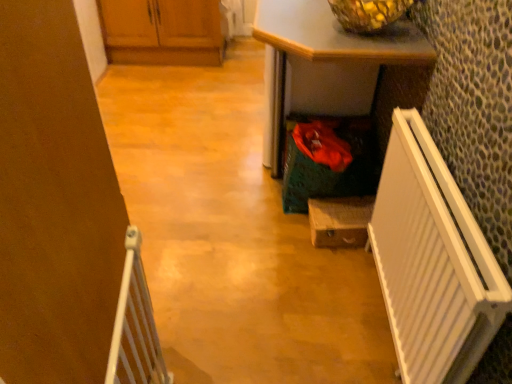
Image resolution: width=512 pixels, height=384 pixels. What are the coordinates of `white plastic radiator at left, positioned as the 1th radiator in left-to-right order` in the screenshot? It's located at [x=135, y=326].

Find the location of a particular element. Image resolution: width=512 pixels, height=384 pixels. wooden cabinets at upper left, marked as the 1th cabinetry in a top-to-bottom arrangement is located at coordinates (163, 32).

This screenshot has height=384, width=512. Find the location of `the 1st cabinetry counting from the left of the white plastic radiator at right, the second radiator viewed from the left`. the 1st cabinetry counting from the left of the white plastic radiator at right, the second radiator viewed from the left is located at coordinates (340, 221).

Can we say white plastic radiator at right, the second radiator viewed from the left, lies outside wooden drawer at center, which is the second cabinetry in back-to-front order?

Indeed, white plastic radiator at right, the second radiator viewed from the left, is completely outside wooden drawer at center, which is the second cabinetry in back-to-front order.

From the image's perspective, is white plastic radiator at right, acting as the first radiator starting from the right, below wooden drawer at center, which appears as the 2th cabinetry when viewed from the top?

Yes, from the image's perspective, white plastic radiator at right, acting as the first radiator starting from the right, is below wooden drawer at center, which appears as the 2th cabinetry when viewed from the top.

Is white plastic radiator at right, the second radiator viewed from the left, not close to wooden drawer at center, marked as the 2th cabinetry in a left-to-right arrangement?

No, there isn't a large distance between white plastic radiator at right, the second radiator viewed from the left, and wooden drawer at center, marked as the 2th cabinetry in a left-to-right arrangement.

The image size is (512, 384). Identify the location of cabinetry that is the 1st one when counting leftward from the white plastic radiator at right, the second radiator viewed from the left. pos(340,221).

Is wooden drawer at center, acting as the 1th cabinetry starting from the front, turned away from white plastic radiator at right, acting as the first radiator starting from the right?

No, wooden drawer at center, acting as the 1th cabinetry starting from the front,'s orientation is not away from white plastic radiator at right, acting as the first radiator starting from the right.

Between point (347, 241) and point (437, 186), which one is positioned in front?

The point (437, 186) is closer to the camera.

Between green textured desk at center and white plastic radiator at left, positioned as the 1th radiator in left-to-right order, which one has larger size?

Bigger between the two is green textured desk at center.

From the image's perspective, is green textured desk at center above or below white plastic radiator at left, positioned as the 1th radiator in left-to-right order?

green textured desk at center is situated higher than white plastic radiator at left, positioned as the 1th radiator in left-to-right order, in the image.

Considering their positions, is green textured desk at center located in front of or behind white plastic radiator at left, positioned as the 1th radiator in left-to-right order?

In the image, green textured desk at center appears behind white plastic radiator at left, positioned as the 1th radiator in left-to-right order.

In the scene shown: Does green textured desk at center turn towards white plastic radiator at left, which is the 2th radiator in right-to-left order?

No, green textured desk at center is not facing towards white plastic radiator at left, which is the 2th radiator in right-to-left order.

The width and height of the screenshot is (512, 384). What are the coordinates of `the 1st radiator in front when counting from the wooden cabinets at upper left, which appears as the 2th cabinetry when ordered from the bottom` in the screenshot? It's located at (432, 262).

In the scene shown: Does wooden cabinets at upper left, which appears as the 2th cabinetry when ordered from the bottom, lie behind white plastic radiator at right, the second radiator viewed from the left?

Yes.

Could white plastic radiator at right, the second radiator viewed from the left, be considered to be inside wooden cabinets at upper left, arranged as the 1th cabinetry when viewed from the left?

No, white plastic radiator at right, the second radiator viewed from the left, is located outside of wooden cabinets at upper left, arranged as the 1th cabinetry when viewed from the left.

From a real-world perspective, between wooden cabinets at upper left, arranged as the 1th cabinetry when viewed from the left, and white plastic radiator at right, the second radiator viewed from the left, who is vertically higher?

From a 3D spatial view, white plastic radiator at right, the second radiator viewed from the left, is above.

From the image's perspective, which is above, green textured desk at center or white plastic radiator at right, acting as the first radiator starting from the right?

green textured desk at center appears higher in the image.

Could you measure the distance between green textured desk at center and white plastic radiator at right, the second radiator viewed from the left?

They are 61.31 centimeters apart.

Looking at the image, does green textured desk at center seem bigger or smaller compared to white plastic radiator at right, the second radiator viewed from the left?

green textured desk at center is bigger than white plastic radiator at right, the second radiator viewed from the left.

Which is farther from the camera, [328,27] or [494,324]?

The point [328,27] is farther from the camera.

Considering the positions of objects white plastic radiator at left, positioned as the 1th radiator in left-to-right order, and green textured desk at center in the image provided, who is more to the right, white plastic radiator at left, positioned as the 1th radiator in left-to-right order, or green textured desk at center?

Positioned to the right is green textured desk at center.

Can you tell me how much white plastic radiator at left, which is the 2th radiator in right-to-left order, and green textured desk at center differ in facing direction?

white plastic radiator at left, which is the 2th radiator in right-to-left order, and green textured desk at center are facing 173 degrees away from each other.

Does white plastic radiator at left, which is the 2th radiator in right-to-left order, contain green textured desk at center?

No, green textured desk at center is located outside of white plastic radiator at left, which is the 2th radiator in right-to-left order.

Who is smaller, white plastic radiator at left, which is the 2th radiator in right-to-left order, or green textured desk at center?

white plastic radiator at left, which is the 2th radiator in right-to-left order.

Is the position of white plastic radiator at left, positioned as the 1th radiator in left-to-right order, more distant than that of wooden cabinets at upper left, marked as the 1th cabinetry in a top-to-bottom arrangement?

No, white plastic radiator at left, positioned as the 1th radiator in left-to-right order, is in front of wooden cabinets at upper left, marked as the 1th cabinetry in a top-to-bottom arrangement.

Considering the sizes of objects white plastic radiator at left, positioned as the 1th radiator in left-to-right order, and wooden cabinets at upper left, which appears as the 2th cabinetry when viewed from the right, in the image provided, who is shorter, white plastic radiator at left, positioned as the 1th radiator in left-to-right order, or wooden cabinets at upper left, which appears as the 2th cabinetry when viewed from the right,?

wooden cabinets at upper left, which appears as the 2th cabinetry when viewed from the right.

Choose the correct answer: Is white plastic radiator at left, positioned as the 1th radiator in left-to-right order, inside wooden cabinets at upper left, which appears as the 2th cabinetry when viewed from the right, or outside it?

white plastic radiator at left, positioned as the 1th radiator in left-to-right order, is spatially situated outside wooden cabinets at upper left, which appears as the 2th cabinetry when viewed from the right.

From the image's perspective, which object appears higher, white plastic radiator at left, positioned as the 1th radiator in left-to-right order, or wooden cabinets at upper left, which appears as the 2th cabinetry when viewed from the right?

From the image's view, wooden cabinets at upper left, which appears as the 2th cabinetry when viewed from the right, is above.

From the image's perspective, starting from the wooden drawer at center, marked as the 2th cabinetry in a left-to-right arrangement, which radiator is the 1st one below? Please provide its 2D coordinates.

[(432, 262)]

Identify the location of cabinetry that is the 1st one when counting backward from the white plastic radiator at right, acting as the first radiator starting from the right. (340, 221).

Estimate the real-world distances between objects in this image. Which object is further from green textured desk at center, wooden drawer at center, which appears as the 2th cabinetry when viewed from the top, or wooden cabinets at upper left, the 1th cabinetry when ordered from back to front?

Among the two, wooden cabinets at upper left, the 1th cabinetry when ordered from back to front, is located further to green textured desk at center.

Which object lies further to the anchor point white plastic radiator at left, positioned as the 1th radiator in left-to-right order, green textured desk at center or wooden drawer at center, which is the first cabinetry from bottom to top?

green textured desk at center.

Looking at the image, which one is located closer to white plastic radiator at left, which is the 2th radiator in right-to-left order, white plastic radiator at right, acting as the first radiator starting from the right, or wooden cabinets at upper left, which is the second cabinetry from front to back?

white plastic radiator at right, acting as the first radiator starting from the right, lies closer to white plastic radiator at left, which is the 2th radiator in right-to-left order, than the other object.

Which object lies further to the anchor point white plastic radiator at right, the second radiator viewed from the left, wooden drawer at center, acting as the 1th cabinetry starting from the front, or white plastic radiator at left, which is the 2th radiator in right-to-left order?

white plastic radiator at left, which is the 2th radiator in right-to-left order, lies further to white plastic radiator at right, the second radiator viewed from the left, than the other object.

From the image, which object appears to be nearer to wooden drawer at center, which appears as the 2th cabinetry when viewed from the top, white plastic radiator at right, the second radiator viewed from the left, or green textured desk at center?

The object closer to wooden drawer at center, which appears as the 2th cabinetry when viewed from the top, is white plastic radiator at right, the second radiator viewed from the left.

Which object lies nearer to the anchor point white plastic radiator at right, the second radiator viewed from the left, green textured desk at center or wooden cabinets at upper left, arranged as the 1th cabinetry when viewed from the left?

green textured desk at center lies closer to white plastic radiator at right, the second radiator viewed from the left, than the other object.

Estimate the real-world distances between objects in this image. Which object is further from wooden drawer at center, which is counted as the 1th cabinetry, starting from the right, white plastic radiator at left, positioned as the 1th radiator in left-to-right order, or white plastic radiator at right, acting as the first radiator starting from the right?

The object further to wooden drawer at center, which is counted as the 1th cabinetry, starting from the right, is white plastic radiator at left, positioned as the 1th radiator in left-to-right order.

When comparing their distances from white plastic radiator at left, which is the 2th radiator in right-to-left order, does wooden drawer at center, acting as the 1th cabinetry starting from the front, or white plastic radiator at right, acting as the first radiator starting from the right, seem closer?

Based on the image, white plastic radiator at right, acting as the first radiator starting from the right, appears to be nearer to white plastic radiator at left, which is the 2th radiator in right-to-left order.

Find the location of a particular element. radiator between white plastic radiator at left, which is the 2th radiator in right-to-left order, and wooden drawer at center, marked as the 2th cabinetry in a left-to-right arrangement, from front to back is located at coordinates (432, 262).

At what (x,y) coordinates should I click in order to perform the action: click on radiator between white plastic radiator at left, which is the 2th radiator in right-to-left order, and wooden cabinets at upper left, arranged as the 1th cabinetry when viewed from the left, in the front-back direction. Please return your answer as a coordinate pair (x, y). Looking at the image, I should click on (432, 262).

The height and width of the screenshot is (384, 512). Find the location of `cabinetry positioned between white plastic radiator at right, acting as the first radiator starting from the right, and wooden cabinets at upper left, which appears as the 2th cabinetry when ordered from the bottom, from near to far`. cabinetry positioned between white plastic radiator at right, acting as the first radiator starting from the right, and wooden cabinets at upper left, which appears as the 2th cabinetry when ordered from the bottom, from near to far is located at coordinates (340, 221).

Where is `desk between white plastic radiator at right, the second radiator viewed from the left, and wooden drawer at center, acting as the 1th cabinetry starting from the front, in the front-back direction`? The height and width of the screenshot is (384, 512). desk between white plastic radiator at right, the second radiator viewed from the left, and wooden drawer at center, acting as the 1th cabinetry starting from the front, in the front-back direction is located at coordinates (324, 47).